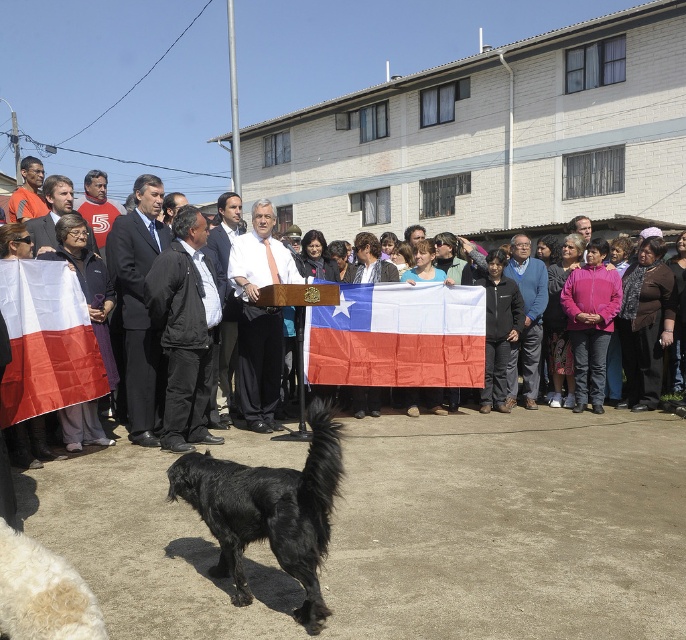
You are a photographer at the event and want to capture a photo where the matte black suit at center is positioned to the left of the red fabric chilean flag at center. Based on the current arrangement, is this already the case?

Yes, the red fabric chilean flag at center is already to the right of the matte black suit at center, so the desired positioning is already achieved.

You are a photographer at the event and want to capture a photo that includes both the matte black dog at lower center and the dark blue sweater at center. Based on their positions, which object should be placed to the left in the frame?

The matte black dog at lower center should be placed to the left in the frame because it is positioned on the left side of the dark blue sweater at center.